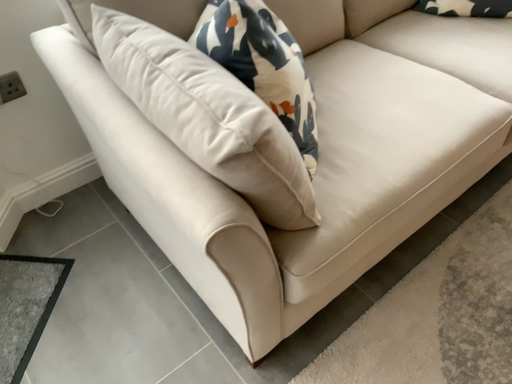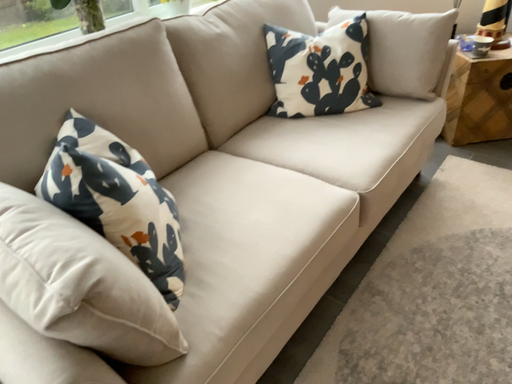
Question: How did the camera likely rotate when shooting the video?

Choices:
 (A) rotated downward
 (B) rotated upward

Answer: (B)